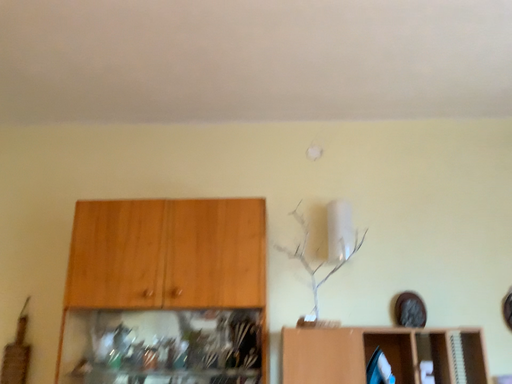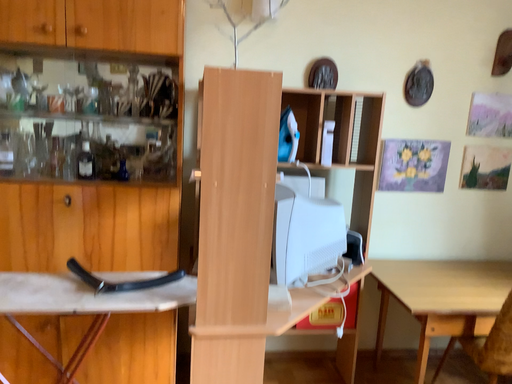
Question: Which way did the camera rotate in the video?

Choices:
 (A) rotated left
 (B) rotated right

Answer: (B)